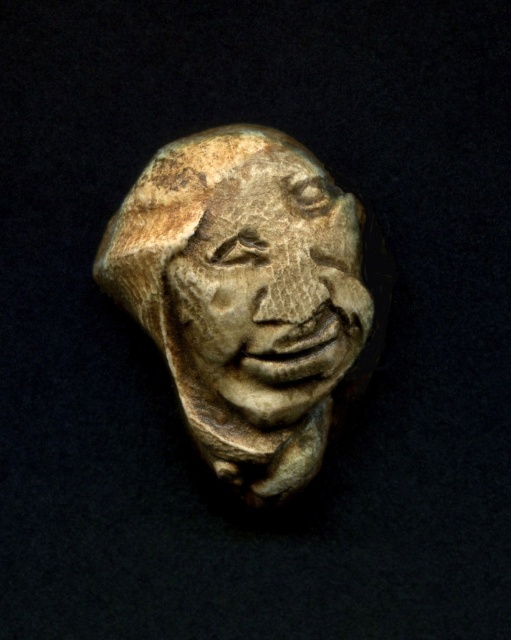
Question: Does matte stone head at center have a larger size compared to carved stone face at center?

Choices:
 (A) yes
 (B) no

Answer: (A)

Question: Where is matte stone head at center located in relation to carved stone face at center in the image?

Choices:
 (A) above
 (B) below

Answer: (B)

Question: Which point is closer to the camera?

Choices:
 (A) matte stone head at center
 (B) carved stone face at center

Answer: (B)

Question: Considering the relative positions of matte stone head at center and carved stone face at center in the image provided, where is matte stone head at center located with respect to carved stone face at center?

Choices:
 (A) above
 (B) below

Answer: (B)

Question: Which point is farther to the camera?

Choices:
 (A) carved stone face at center
 (B) matte stone head at center

Answer: (B)

Question: Which object appears closest to the camera in this image?

Choices:
 (A) carved stone face at center
 (B) matte stone head at center

Answer: (A)